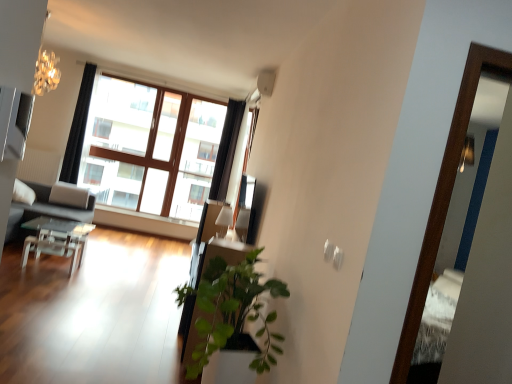
Question: Is transparent glass table at lower left bigger than wooden screen door at right?

Choices:
 (A) no
 (B) yes

Answer: (B)

Question: Is transparent glass table at lower left beside wooden screen door at right?

Choices:
 (A) no
 (B) yes

Answer: (A)

Question: Is wooden screen door at right completely or partially inside transparent glass table at lower left?

Choices:
 (A) no
 (B) yes

Answer: (A)

Question: Would you say transparent glass table at lower left is outside wooden screen door at right?

Choices:
 (A) no
 (B) yes

Answer: (B)

Question: Can you confirm if transparent glass table at lower left is thinner than wooden screen door at right?

Choices:
 (A) no
 (B) yes

Answer: (A)

Question: In terms of height, does wooden screen door at right look taller or shorter compared to wooden window at center?

Choices:
 (A) short
 (B) tall

Answer: (A)

Question: In the image, is wooden screen door at right on the left side or the right side of wooden window at center?

Choices:
 (A) right
 (B) left

Answer: (A)

Question: Considering their positions, is wooden screen door at right located in front of or behind wooden window at center?

Choices:
 (A) front
 (B) behind

Answer: (A)

Question: Considering the positions of wooden screen door at right and wooden window at center in the image, is wooden screen door at right wider or thinner than wooden window at center?

Choices:
 (A) thin
 (B) wide

Answer: (A)

Question: In the image, is black fabric curtain at upper left, which appears as the 1th curtain when viewed from the left, positioned in front of or behind wooden window at center?

Choices:
 (A) behind
 (B) front

Answer: (B)

Question: Is black fabric curtain at upper left, which appears as the 1th curtain when viewed from the left, situated inside wooden window at center or outside?

Choices:
 (A) inside
 (B) outside

Answer: (B)

Question: Looking at the image, does black fabric curtain at upper left, which appears as the 1th curtain when viewed from the left, seem bigger or smaller compared to wooden window at center?

Choices:
 (A) big
 (B) small

Answer: (B)

Question: In terms of height, does black fabric curtain at upper left, the 2th curtain positioned from the right, look taller or shorter compared to wooden window at center?

Choices:
 (A) short
 (B) tall

Answer: (A)

Question: Looking at the image, does matte gray couch at left seem bigger or smaller compared to white painted wood at center?

Choices:
 (A) big
 (B) small

Answer: (A)

Question: Considering the positions of matte gray couch at left and white painted wood at center in the image, is matte gray couch at left wider or thinner than white painted wood at center?

Choices:
 (A) wide
 (B) thin

Answer: (A)